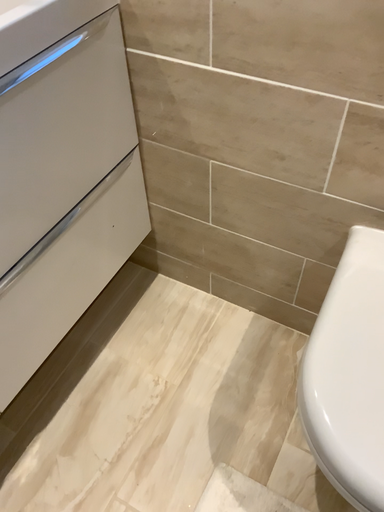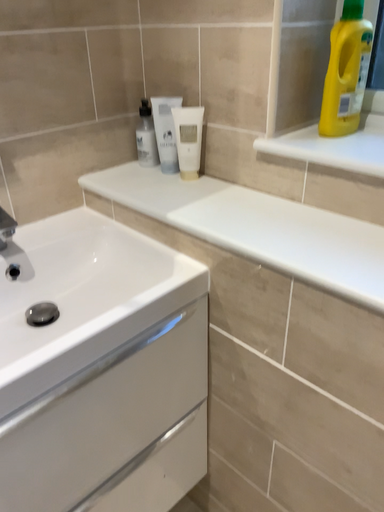
Question: Which way did the camera rotate in the video?

Choices:
 (A) rotated upward
 (B) rotated downward

Answer: (A)